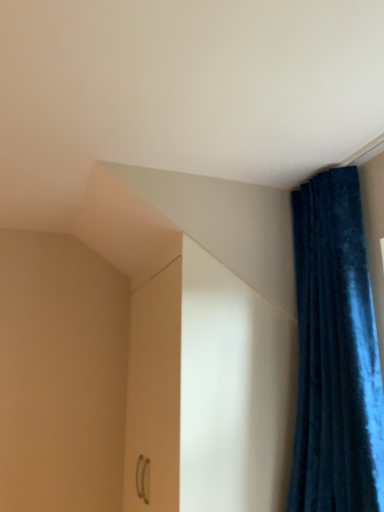
Question: Can you confirm if velvet blue curtain at upper right is thinner than white glossy cabinet at center?

Choices:
 (A) yes
 (B) no

Answer: (B)

Question: Is velvet blue curtain at upper right to the right of white glossy cabinet at center from the viewer's perspective?

Choices:
 (A) no
 (B) yes

Answer: (B)

Question: Is velvet blue curtain at upper right oriented away from white glossy cabinet at center?

Choices:
 (A) no
 (B) yes

Answer: (A)

Question: Is velvet blue curtain at upper right located outside white glossy cabinet at center?

Choices:
 (A) no
 (B) yes

Answer: (B)

Question: From the image's perspective, is velvet blue curtain at upper right under white glossy cabinet at center?

Choices:
 (A) no
 (B) yes

Answer: (A)

Question: Is white glossy cabinet at center a part of velvet blue curtain at upper right?

Choices:
 (A) yes
 (B) no

Answer: (B)

Question: Considering the relative sizes of white glossy cabinet at center and velvet blue curtain at upper right in the image provided, is white glossy cabinet at center wider than velvet blue curtain at upper right?

Choices:
 (A) yes
 (B) no

Answer: (B)

Question: From a real-world perspective, does white glossy cabinet at center sit lower than velvet blue curtain at upper right?

Choices:
 (A) no
 (B) yes

Answer: (B)

Question: Is white glossy cabinet at center turned away from velvet blue curtain at upper right?

Choices:
 (A) yes
 (B) no

Answer: (B)

Question: Can we say white glossy cabinet at center lies outside velvet blue curtain at upper right?

Choices:
 (A) no
 (B) yes

Answer: (B)

Question: Does white glossy cabinet at center appear on the left side of velvet blue curtain at upper right?

Choices:
 (A) yes
 (B) no

Answer: (A)

Question: Considering the relative positions of white glossy cabinet at center and velvet blue curtain at upper right in the image provided, is white glossy cabinet at center behind velvet blue curtain at upper right?

Choices:
 (A) no
 (B) yes

Answer: (B)

Question: Considering the positions of velvet blue curtain at upper right and white glossy cabinet at center in the image, is velvet blue curtain at upper right taller or shorter than white glossy cabinet at center?

Choices:
 (A) tall
 (B) short

Answer: (A)